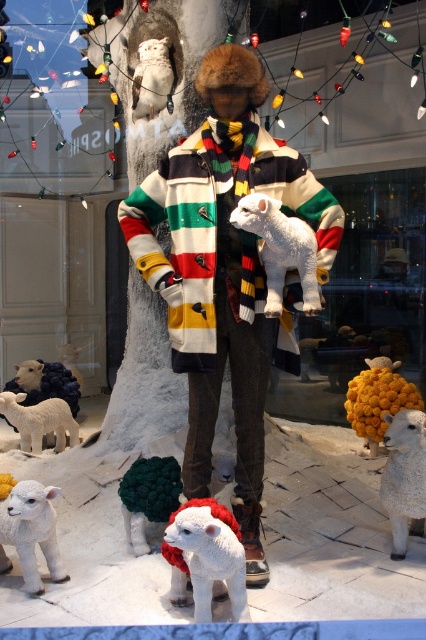
You are a customer looking at the winter display and want to take a photo of the white plush lamb at center without the white fluffy sheep at upper center appearing in the background. Is this possible based on their positions?

The white plush lamb at center is in front of the white fluffy sheep at upper center, so if you position yourself so that the lamb blocks the view of the sheep, you can take a photo of the lamb without the sheep appearing in the background.

You are a photographer standing at the camera position in the winter display scene. You want to take a closeup photo of the white plush lamb at center. Is the lamb within your camera range? The camera can focus on objects up to 2 meters away.

The white plush lamb at center is 2.06 meters away from camera, which is slightly beyond the camera range of 2 meters. The photographer will need to move closer to capture the closeup.